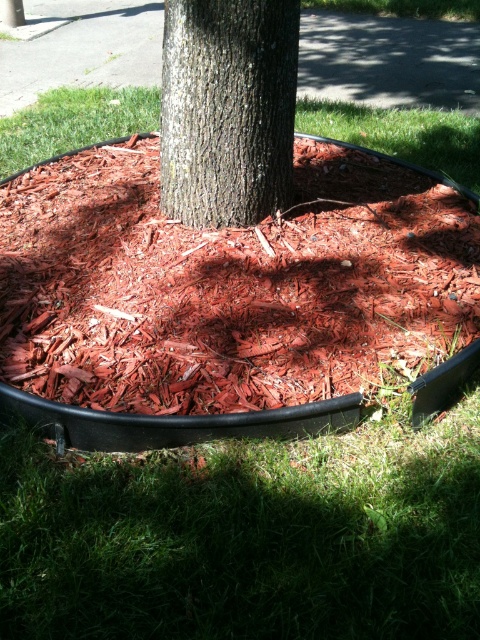
In the scene shown: Who is higher up, red mulch at center or smooth bark tree trunk at center?

smooth bark tree trunk at center

Which is in front, point (118, 228) or point (240, 134)?

Point (240, 134)

Who is more forward, (x=407, y=230) or (x=240, y=202)?

Point (x=240, y=202) is more forward.

I want to click on red mulch at center, so [x=224, y=298].